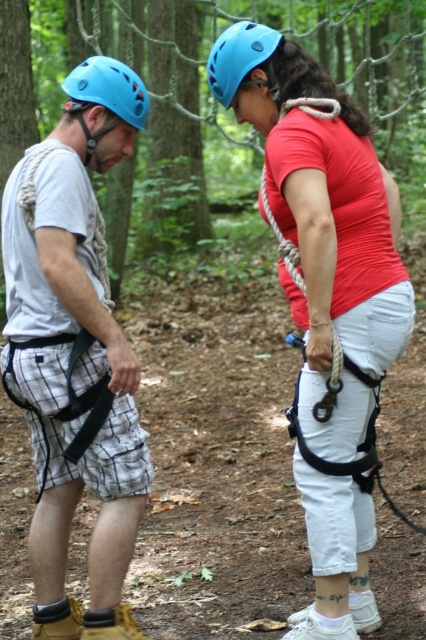
Question: Estimate the real-world distances between objects in this image. Which object is farther from the matte black harness at left?

Choices:
 (A) blue matte helmet at upper center
 (B) blue matte helmet at left

Answer: (A)

Question: Which point is farther to the camera?

Choices:
 (A) blue matte helmet at upper center
 (B) blue matte helmet at left
 (C) matte black harness at left
 (D) matte red shirt at center

Answer: (A)

Question: Does matte red shirt at center appear on the right side of blue matte helmet at upper center?

Choices:
 (A) yes
 (B) no

Answer: (A)

Question: Is blue matte helmet at left thinner than blue matte helmet at upper center?

Choices:
 (A) yes
 (B) no

Answer: (B)

Question: Estimate the real-world distances between objects in this image. Which object is closer to the matte red shirt at center?

Choices:
 (A) matte black harness at left
 (B) blue matte helmet at left

Answer: (A)

Question: Is matte black harness at left positioned before blue matte helmet at upper center?

Choices:
 (A) yes
 (B) no

Answer: (A)